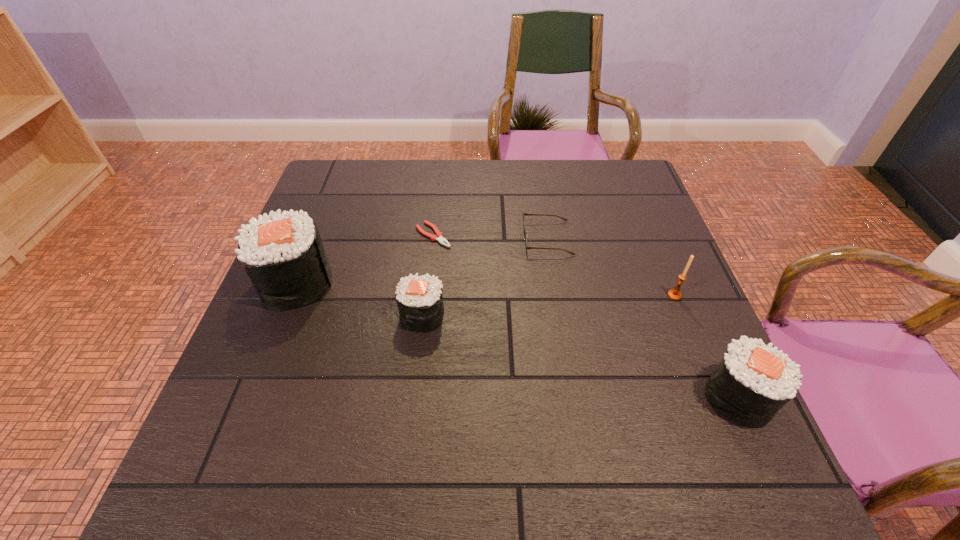
This screenshot has height=540, width=960. Identify the location of free space for an extra sushi to achieve even spacing. (568, 353).